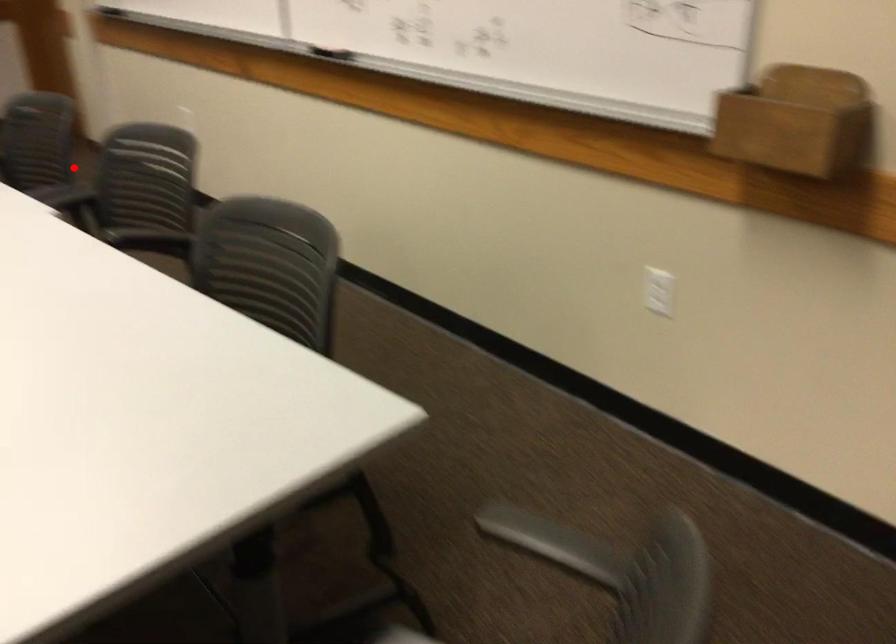
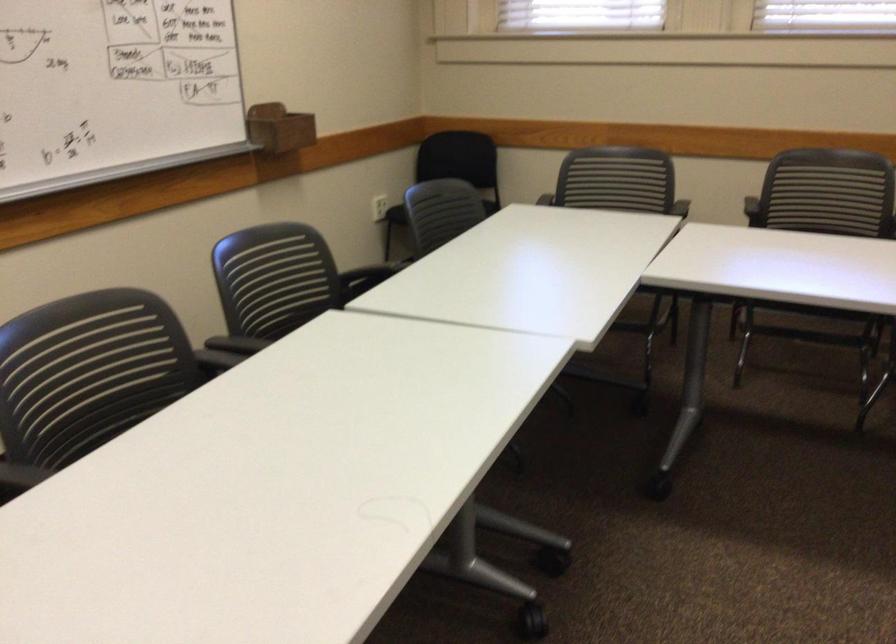
Question: I am providing you with two images of the same scene from different viewpoints. Given a red point in image1, look at the same physical point in image2. Is it:

Choices:
 (A) Closer to the viewpoint
 (B) Farther from the viewpoint

Answer: (A)